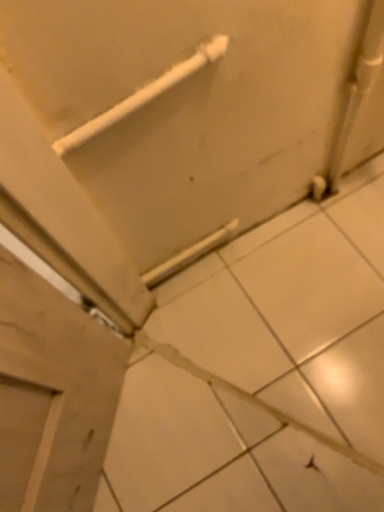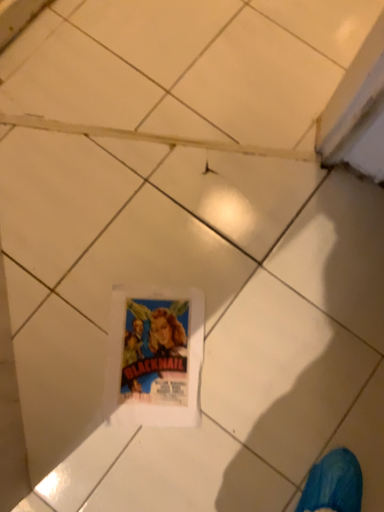
Question: Which way did the camera rotate in the video?

Choices:
 (A) rotated right
 (B) rotated left

Answer: (A)